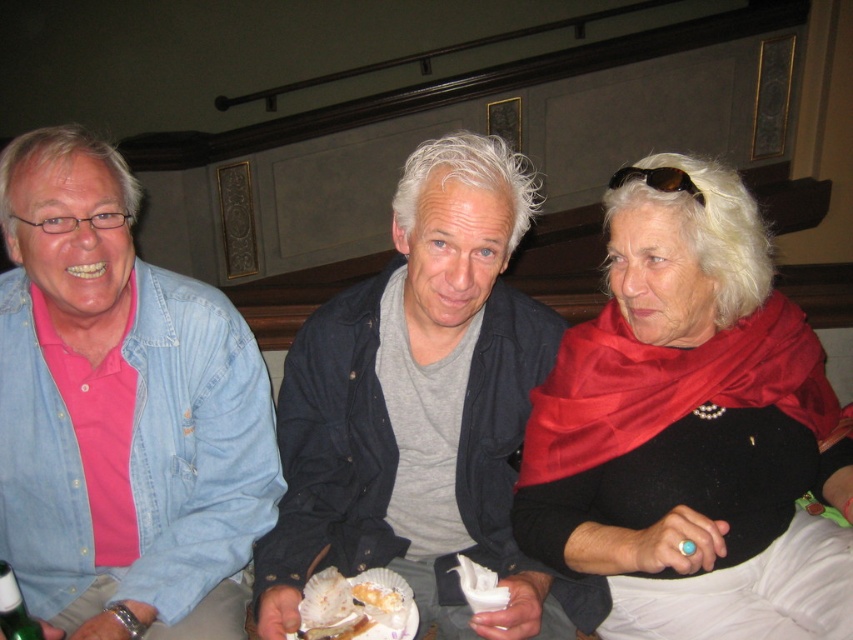
Between white scallop shell at center and brown plastic sunglasses at upper center, which one has more height?

With more height is brown plastic sunglasses at upper center.

Does white scallop shell at center lie in front of brown plastic sunglasses at upper center?

Yes.

Does point (311, 582) come behind point (674, 176)?

Yes, point (311, 582) is farther from viewer.

Find the location of `white scallop shell at center`. white scallop shell at center is located at coordinates (357, 602).

From the picture: Can you confirm if white scallop shell at center is shorter than golden flaky pastry at center?

In fact, white scallop shell at center may be taller than golden flaky pastry at center.

Between point (302, 614) and point (369, 608), which one is positioned behind?

Positioned behind is point (369, 608).

The height and width of the screenshot is (640, 853). In order to click on white scallop shell at center in this screenshot , I will do `click(357, 602)`.

Can you confirm if satin red scarf at upper right is positioned to the right of matte blue denim jacket at left?

Yes, satin red scarf at upper right is to the right of matte blue denim jacket at left.

In the scene shown: Does satin red scarf at upper right lie behind matte blue denim jacket at left?

No, satin red scarf at upper right is in front of matte blue denim jacket at left.

What do you see at coordinates (692, 433) in the screenshot?
I see `satin red scarf at upper right` at bounding box center [692, 433].

Find the location of a particular element. This screenshot has height=640, width=853. satin red scarf at upper right is located at coordinates (692, 433).